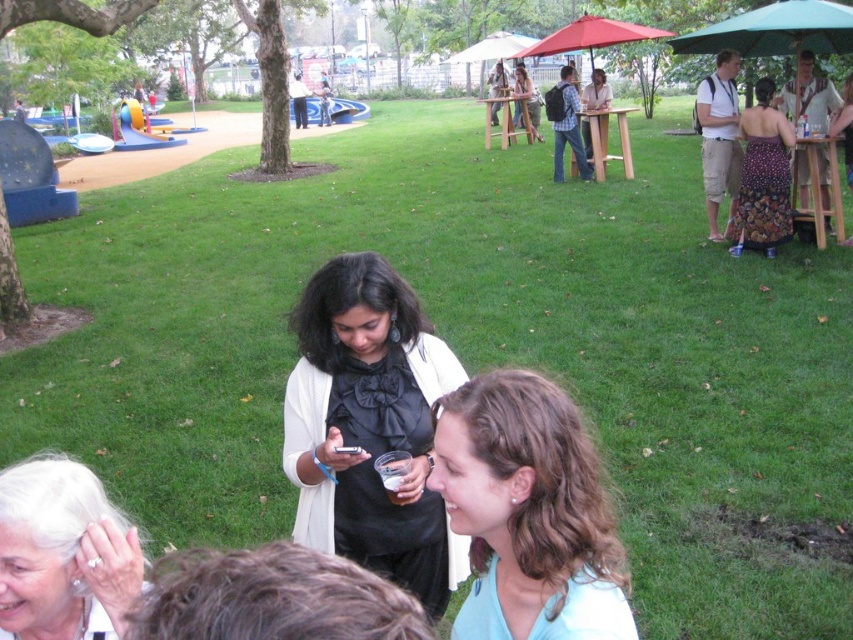
Question: Which object is positioned farthest from the floral dress at right?

Choices:
 (A) black satin dress at center
 (B) white pearl earring at lower left
 (C) wooden picnic table at right
 (D) green fabric umbrella at right

Answer: (B)

Question: Among these points, which one is nearest to the camera?

Choices:
 (A) (315, 531)
 (B) (842, 225)
 (C) (598, 163)
 (D) (485, 573)

Answer: (D)

Question: Is green fabric umbrella at right positioned behind wooden picnic table at center?

Choices:
 (A) yes
 (B) no

Answer: (B)

Question: Is light blue fabric at center wider than light brown wooden picnic table at center?

Choices:
 (A) no
 (B) yes

Answer: (A)

Question: Among these objects, which one is farthest from the camera?

Choices:
 (A) light brown wooden picnic table at center
 (B) wooden picnic table at right
 (C) green fabric umbrella at right
 (D) floral dress at right

Answer: (A)

Question: Does light blue fabric at center lie behind white pearl earring at lower left?

Choices:
 (A) no
 (B) yes

Answer: (B)